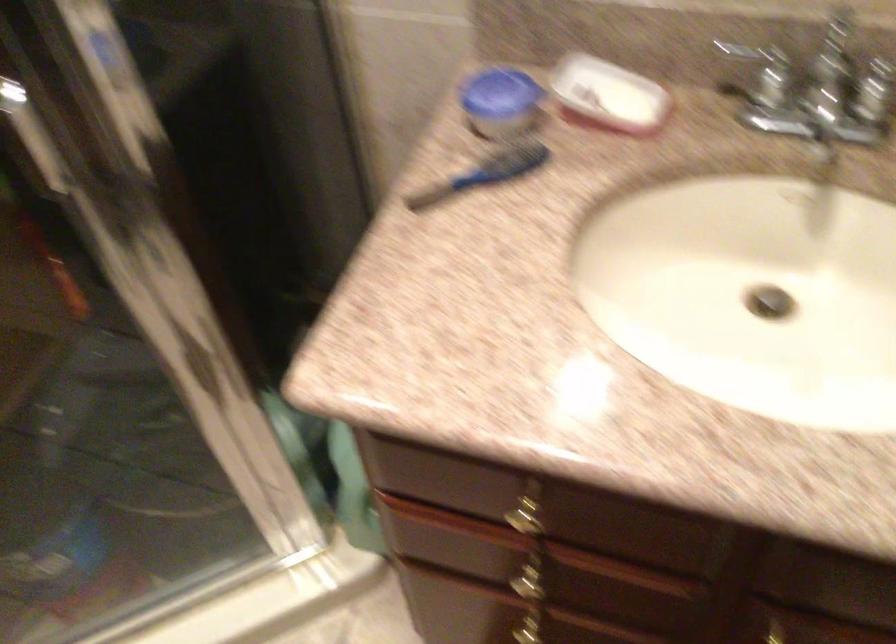
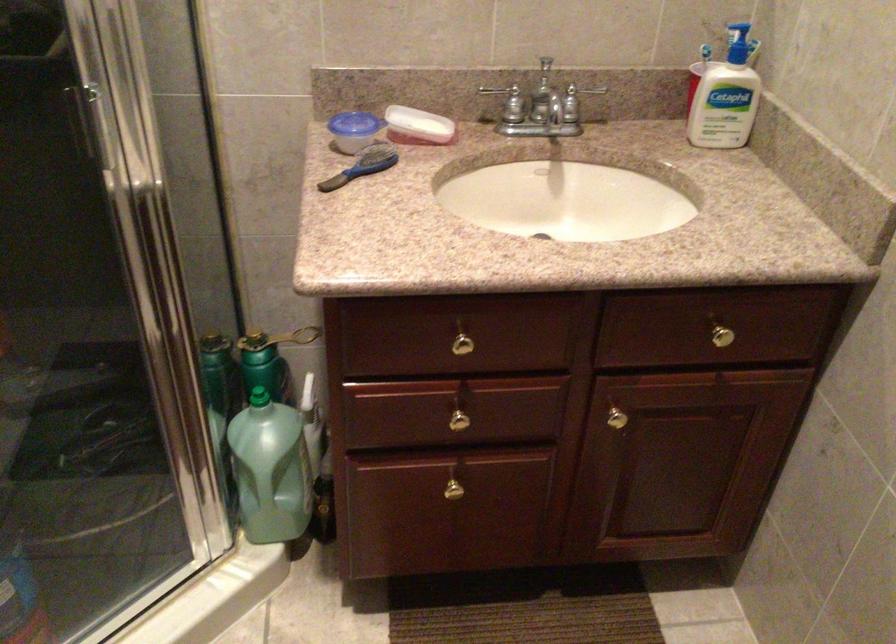
The point at (767,75) is marked in the first image. Where is the corresponding point in the second image?

(509, 102)